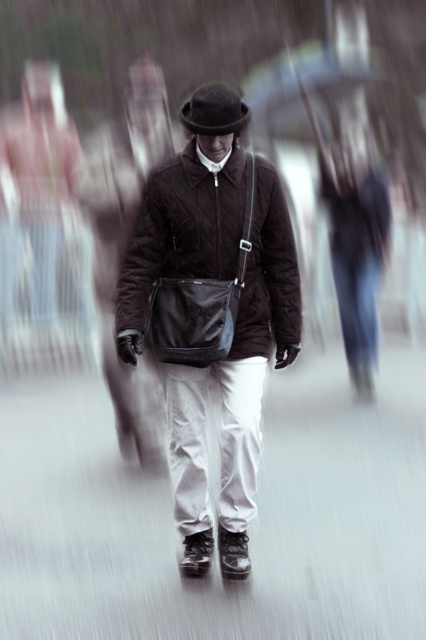
Based on the scene description, what is located at the coordinates point [250,531]?

The white smooth pavement at center is located at point [250,531].

You are a photographer who wants to capture a clear photo of the white smooth pavement at center. You are currently standing at the camera position. What should you do to ensure the pavement is in focus?

To ensure the white smooth pavement at center is in focus, you should adjust the camera settings to focus on the pavement, which is 17.36 feet away from the camera position.

You are a photographer trying to capture a clear image of the black felt fedora at center and the white smooth pavement at center. Which object should you focus on to ensure it appears sharp in the photo?

You should focus on the black felt fedora at center because it is further away from the viewer compared to the white smooth pavement at center, so focusing on it will ensure it remains sharp while the other may be slightly blurred.